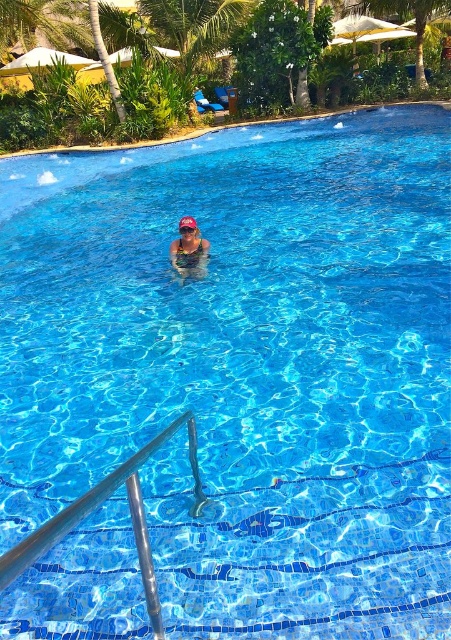
You are a guest at the resort and want to put your transparent plastic goggles at center on the silver metallic rail at lower left. Can you place them directly on top of the rail without any obstruction?

The silver metallic rail at lower left is in front of the transparent plastic goggles at center, meaning the goggles are behind the rail. To place the goggles on the rail, you would need to move them forward to the rail since they are currently positioned behind it.

You are a lifeguard standing at the center of the pool deck. You need to quickly reach the silver metallic rail at lower left. Which direction should you move to get there?

The silver metallic rail at lower left is located at coordinates point (100, 504), so you should move towards the lower left direction to reach it.

In the scene shown: You are designing a safety inspection checklist for the pool area. You need to ensure that the silver metallic rail at lower left and the matte blue swimsuit at center are both visible to lifeguards. Considering their sizes, which object might be harder to spot from a distance?

The matte blue swimsuit at center might be harder to spot from a distance because it is smaller than the silver metallic rail at lower left.